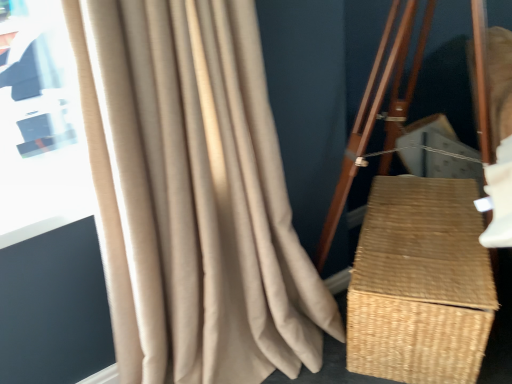
What do you see at coordinates (420, 283) in the screenshot? I see `woven natural basket at right` at bounding box center [420, 283].

Image resolution: width=512 pixels, height=384 pixels. I want to click on woven natural basket at right, so click(420, 283).

The image size is (512, 384). Find the location of `beige textured curtain at left`. beige textured curtain at left is located at coordinates (193, 195).

Image resolution: width=512 pixels, height=384 pixels. Describe the element at coordinates (193, 195) in the screenshot. I see `beige textured curtain at left` at that location.

Identify the location of woven natural basket at right. 420,283.

Which is more to the right, beige textured curtain at left or woven natural basket at right?

woven natural basket at right.

Which object is closer to the camera, beige textured curtain at left or woven natural basket at right?

beige textured curtain at left is in front.

Is point (233, 63) positioned after point (396, 328)?

That is False.

From the image's perspective, between beige textured curtain at left and woven natural basket at right, which one is located above?

From the image's view, beige textured curtain at left is above.

From a real-world perspective, between beige textured curtain at left and woven natural basket at right, who is vertically lower?

From a 3D spatial view, woven natural basket at right is below.

Between beige textured curtain at left and woven natural basket at right, which one has larger width?

woven natural basket at right is wider.

Can you confirm if beige textured curtain at left is taller than woven natural basket at right?

Indeed, beige textured curtain at left has a greater height compared to woven natural basket at right.

Considering the sizes of objects beige textured curtain at left and woven natural basket at right in the image provided, who is smaller, beige textured curtain at left or woven natural basket at right?

Smaller between the two is woven natural basket at right.

Is beige textured curtain at left not inside woven natural basket at right?

That's correct, beige textured curtain at left is outside of woven natural basket at right.

Is the surface of beige textured curtain at left in direct contact with woven natural basket at right?

No, beige textured curtain at left is not in contact with woven natural basket at right.

Is beige textured curtain at left facing away from woven natural basket at right?

That's not correct — beige textured curtain at left is not looking away from woven natural basket at right.

Can you tell me how much beige textured curtain at left and woven natural basket at right differ in facing direction?

There is a 39.7-degree angle between the facing directions of beige textured curtain at left and woven natural basket at right.

How distant is beige textured curtain at left from woven natural basket at right?

They are 18.28 inches apart.

Locate an element on the screen. The image size is (512, 384). curtain in front of the woven natural basket at right is located at coordinates (193, 195).

Based on their positions, is woven natural basket at right located to the left or right of beige textured curtain at left?

woven natural basket at right is to the right of beige textured curtain at left.

Considering the relative positions of woven natural basket at right and beige textured curtain at left in the image provided, is woven natural basket at right in front of beige textured curtain at left?

That is False.

Does point (453, 262) lie in front of point (256, 299)?

No, (453, 262) is behind (256, 299).

From the image's perspective, is woven natural basket at right located above beige textured curtain at left?

Actually, woven natural basket at right appears below beige textured curtain at left in the image.

From a real-world perspective, relative to beige textured curtain at left, is woven natural basket at right vertically above or below?

In terms of real-world spatial position, woven natural basket at right is below beige textured curtain at left.

Can you confirm if woven natural basket at right is thinner than beige textured curtain at left?

In fact, woven natural basket at right might be wider than beige textured curtain at left.

Who is shorter, woven natural basket at right or beige textured curtain at left?

Standing shorter between the two is woven natural basket at right.

Considering the relative sizes of woven natural basket at right and beige textured curtain at left in the image provided, is woven natural basket at right smaller than beige textured curtain at left?

Yes.

Is woven natural basket at right situated inside beige textured curtain at left or outside?

woven natural basket at right is not inside beige textured curtain at left, it's outside.

Is woven natural basket at right not near beige textured curtain at left?

No, woven natural basket at right is not far away from beige textured curtain at left.

Is woven natural basket at right looking in the opposite direction of beige textured curtain at left?

No, woven natural basket at right is not facing the opposite direction of beige textured curtain at left.

Can you tell me how much woven natural basket at right and beige textured curtain at left differ in facing direction?

The angular difference between woven natural basket at right and beige textured curtain at left is 39.7 degrees.

Where is `curtain on the left of woven natural basket at right`? This screenshot has width=512, height=384. curtain on the left of woven natural basket at right is located at coordinates click(193, 195).

Find the location of `basket behind the beige textured curtain at left`. basket behind the beige textured curtain at left is located at coordinates click(420, 283).

I want to click on basket below the beige textured curtain at left (from a real-world perspective), so click(420, 283).